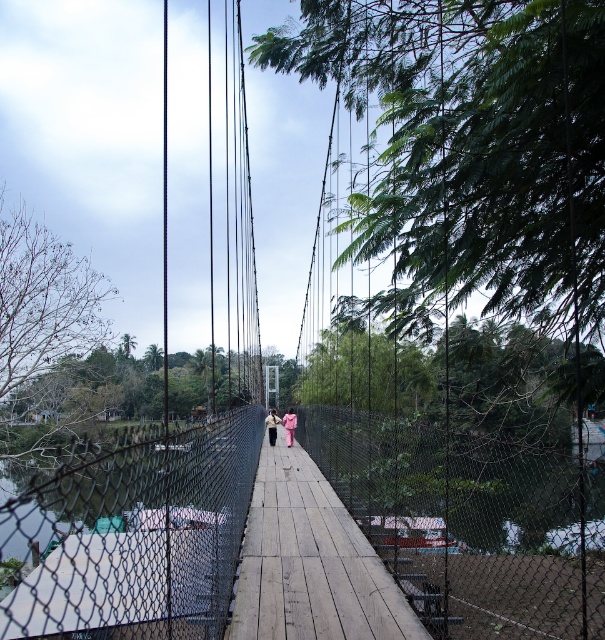
You are standing on the suspension bridge and notice a pink fabric at center. If you want to pick it up, which direction should you move relative to your current position?

The pink fabric at center is located at point 0.666 along the horizontal axis and 0.479 along the vertical axis, so you should move towards the center of the bridge to reach it.

You are standing on the suspension bridge and want to walk towards the two people ahead. You notice two points marked on the bridge deck at coordinates point (293, 412) and point (270, 428). Which point should you step on first if you want to reach the people as quickly as possible?

You should step on point (293, 412) first because it is closer to you than point (270, 428), so reaching it first will put you on the path toward the people more quickly.